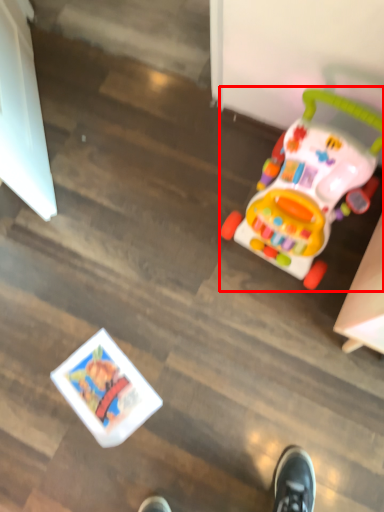
Question: From the image's perspective, what is the correct spatial positioning of toy (annotated by the red box) in reference to toy?

Choices:
 (A) below
 (B) above

Answer: (B)